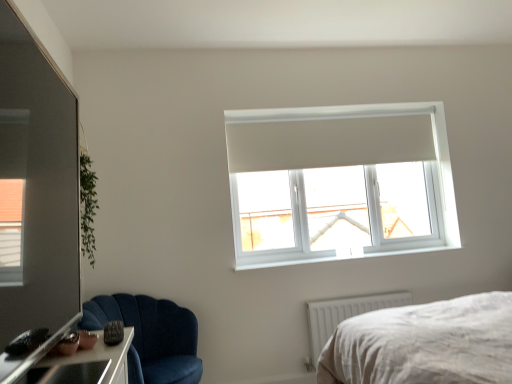
Question: From the image's perspective, is white plastic window sill at upper center under transparent glass door at left?

Choices:
 (A) no
 (B) yes

Answer: (B)

Question: Considering the relative sizes of white plastic window sill at upper center and transparent glass door at left in the image provided, is white plastic window sill at upper center wider than transparent glass door at left?

Choices:
 (A) no
 (B) yes

Answer: (B)

Question: Can we say white plastic window sill at upper center lies outside transparent glass door at left?

Choices:
 (A) yes
 (B) no

Answer: (A)

Question: Considering the relative sizes of white plastic window sill at upper center and transparent glass door at left in the image provided, is white plastic window sill at upper center taller than transparent glass door at left?

Choices:
 (A) no
 (B) yes

Answer: (A)

Question: From a real-world perspective, is white plastic window sill at upper center positioned over transparent glass door at left based on gravity?

Choices:
 (A) yes
 (B) no

Answer: (B)

Question: From a real-world perspective, relative to white plastic radiator at lower right, is velvet blue chair at lower left vertically above or below?

Choices:
 (A) above
 (B) below

Answer: (A)

Question: From the image's perspective, is velvet blue chair at lower left positioned above or below white plastic radiator at lower right?

Choices:
 (A) below
 (B) above

Answer: (B)

Question: Based on their sizes in the image, would you say velvet blue chair at lower left is bigger or smaller than white plastic radiator at lower right?

Choices:
 (A) big
 (B) small

Answer: (A)

Question: Considering the positions of velvet blue chair at lower left and white plastic radiator at lower right in the image, is velvet blue chair at lower left wider or thinner than white plastic radiator at lower right?

Choices:
 (A) thin
 (B) wide

Answer: (B)

Question: From their relative heights in the image, would you say white plastic window sill at upper center is taller or shorter than velvet blue chair at lower left?

Choices:
 (A) short
 (B) tall

Answer: (A)

Question: In terms of size, does white plastic window sill at upper center appear bigger or smaller than velvet blue chair at lower left?

Choices:
 (A) small
 (B) big

Answer: (A)

Question: Is point (265, 266) closer or farther from the camera than point (136, 301)?

Choices:
 (A) closer
 (B) farther

Answer: (B)

Question: Is white plastic window sill at upper center wider or thinner than velvet blue chair at lower left?

Choices:
 (A) thin
 (B) wide

Answer: (A)

Question: Considering their positions, is velvet blue chair at lower left located in front of or behind transparent glass door at left?

Choices:
 (A) front
 (B) behind

Answer: (B)

Question: Considering the positions of velvet blue chair at lower left and transparent glass door at left in the image, is velvet blue chair at lower left taller or shorter than transparent glass door at left?

Choices:
 (A) tall
 (B) short

Answer: (A)